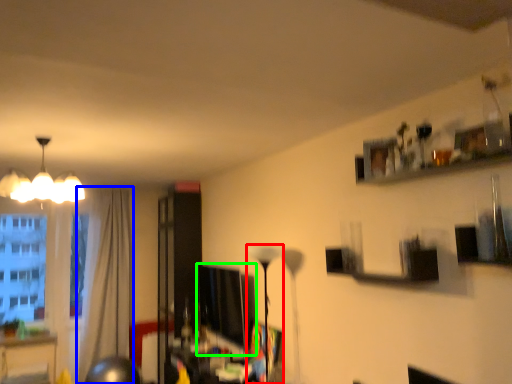
Question: Which object is the closest to the lamp (highlighted by a red box)? Choose among these: curtain (highlighted by a blue box) or computer monitor (highlighted by a green box).

Choices:
 (A) curtain
 (B) computer monitor

Answer: (B)